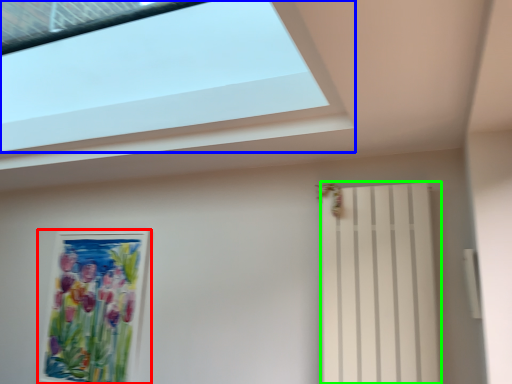
Question: Which object is the farthest from picture frame (highlighted by a red box)? Choose among these: window (highlighted by a blue box) or shutter (highlighted by a green box).

Choices:
 (A) window
 (B) shutter

Answer: (B)